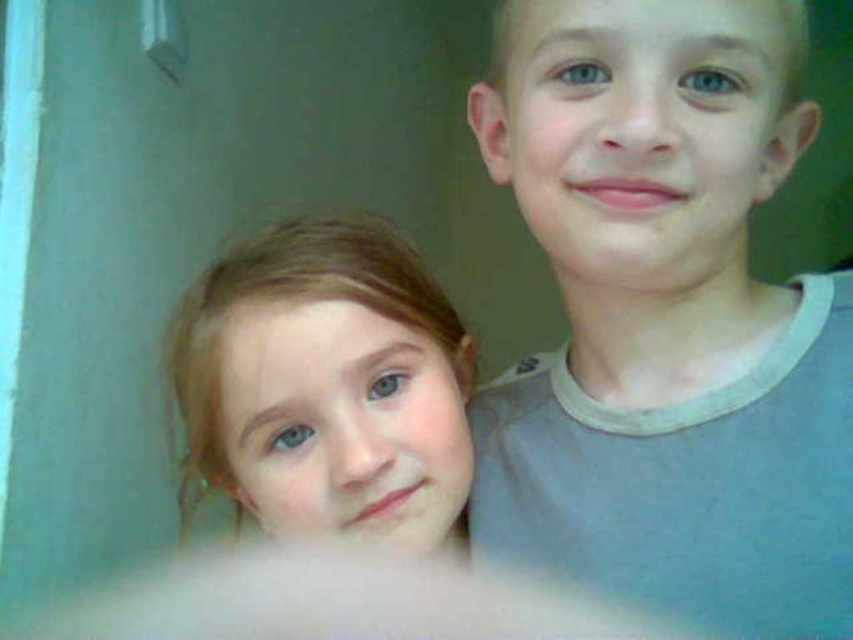
You are a photographer setting up for a group photo. You have to ensure that the gray cotton shirt at right and the smooth blonde hair at lower left are both visible in the frame. Considering their sizes, which object should you focus on to ensure both are in focus?

The gray cotton shirt at right has a larger size compared to smooth blonde hair at lower left. To ensure both are in focus, focus on the gray cotton shirt at right since it is larger and will require more attention to detail to capture clearly.

You are a photographer setting up for a group photo. You need to place a microphone exactly at the center of the gray cotton shirt at right. What are the coordinates where you should place the microphone?

The coordinates for placing the microphone should be at point (666, 320), as this is the position of the gray cotton shirt at right.

You are a photographer setting up for a group photo. You have two markers placed at coordinates point (509, 10) and point (430, 444). If you want to position yourself so that both markers are visible in your frame, which marker should you stand closer to?

You should stand closer to point (430, 444) because point (509, 10) is behind it, so positioning yourself closer to the front marker ensures both are visible.